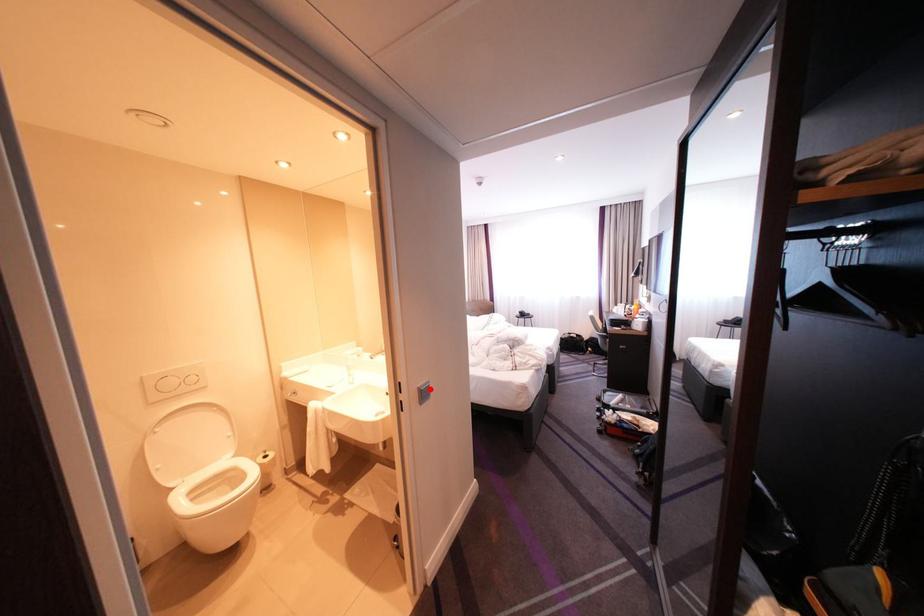
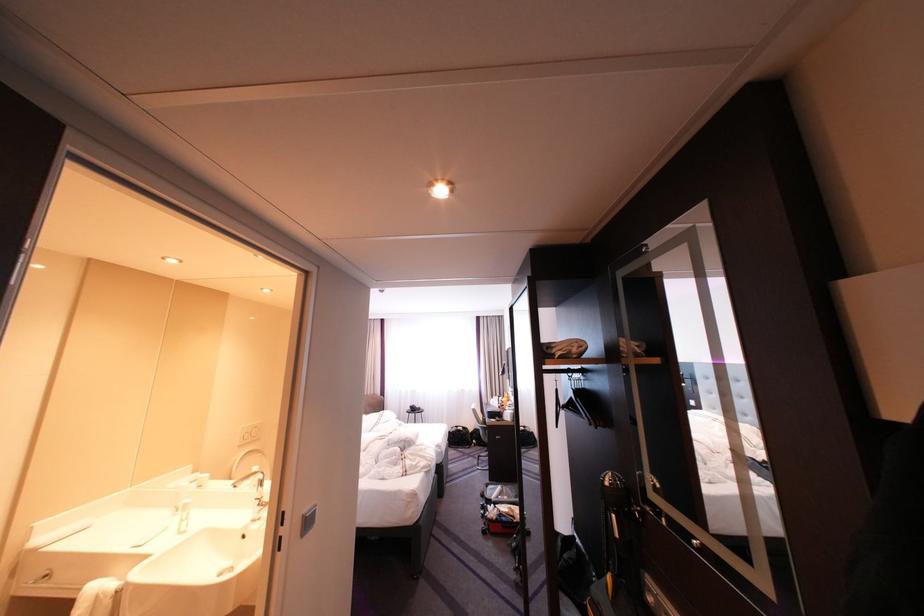
Where in the second image is the point corresponding to the highlighted location from the first image?

(314, 516)